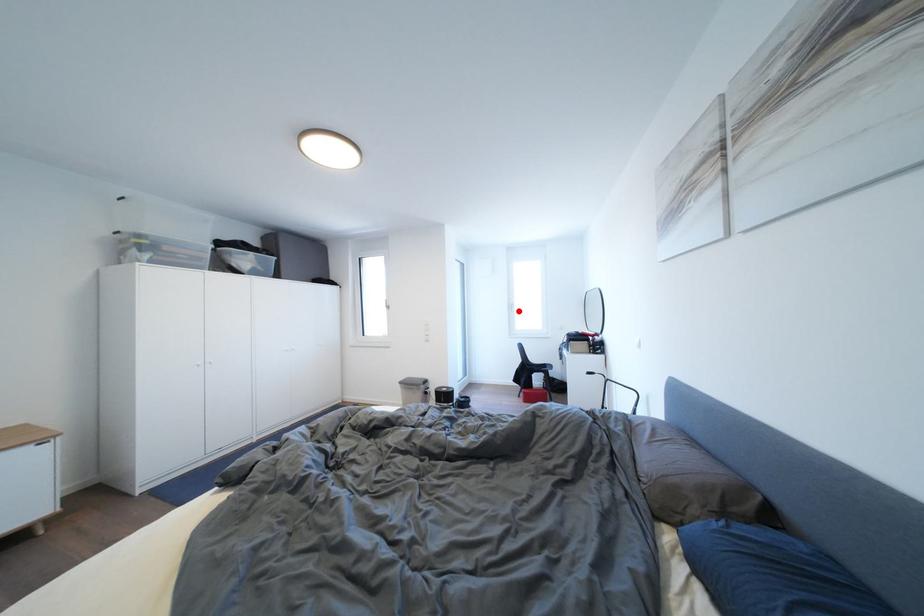
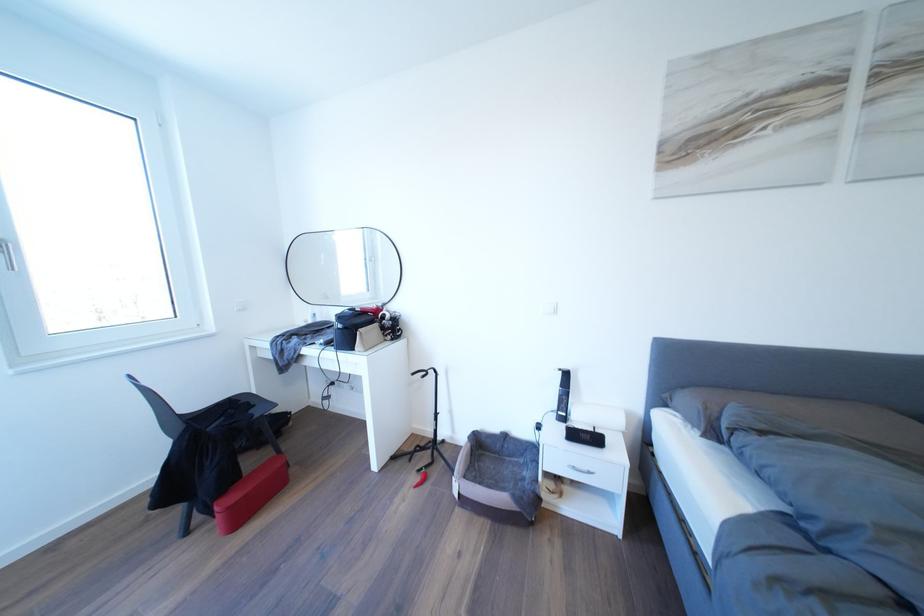
The point at the highlighted location is marked in the first image. Where is the corresponding point in the second image?

(6, 254)